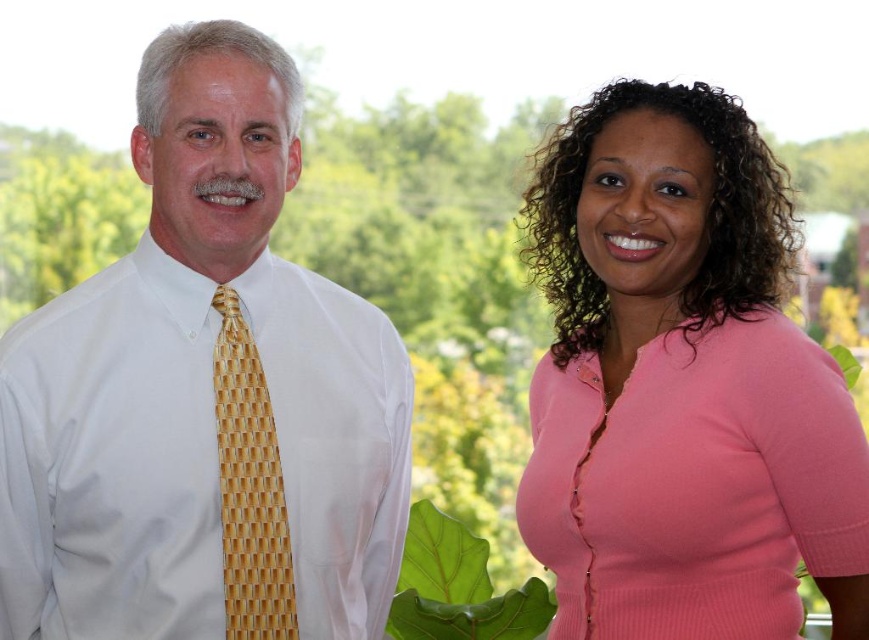
Question: Can you confirm if yellow woven tie at left is bigger than green leafy plant at lower center?

Choices:
 (A) no
 (B) yes

Answer: (A)

Question: Can you confirm if white woven tie at left is positioned to the left of green leafy plant at lower center?

Choices:
 (A) yes
 (B) no

Answer: (A)

Question: Is pink ribbed sweater at right wider than yellow woven tie at left?

Choices:
 (A) yes
 (B) no

Answer: (A)

Question: Which point is farther to the camera?

Choices:
 (A) (270, 144)
 (B) (450, 520)

Answer: (B)

Question: Which of the following is the farthest from the observer?

Choices:
 (A) coord(150,442)
 (B) coord(229,426)
 (C) coord(569,509)

Answer: (C)

Question: Which object appears closest to the camera in this image?

Choices:
 (A) pink ribbed sweater at right
 (B) yellow woven tie at left
 (C) white woven tie at left

Answer: (A)